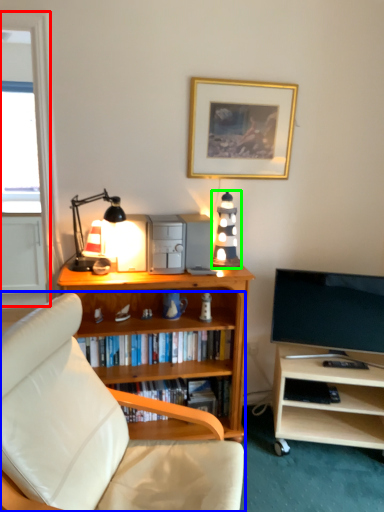
Question: Which object is positioned farthest from glass door (highlighted by a red box)? Select from studio couch (highlighted by a blue box) and speaker (highlighted by a green box).

Choices:
 (A) studio couch
 (B) speaker

Answer: (A)